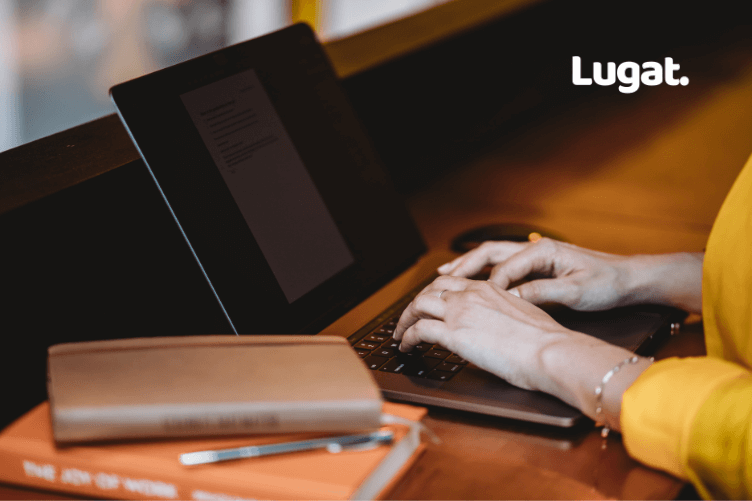
At what (x,y) coordinates should I click in order to perform the action: click on reflection of laptop. Please return your answer as a coordinate pair (x, y). Looking at the image, I should click on (511, 435).